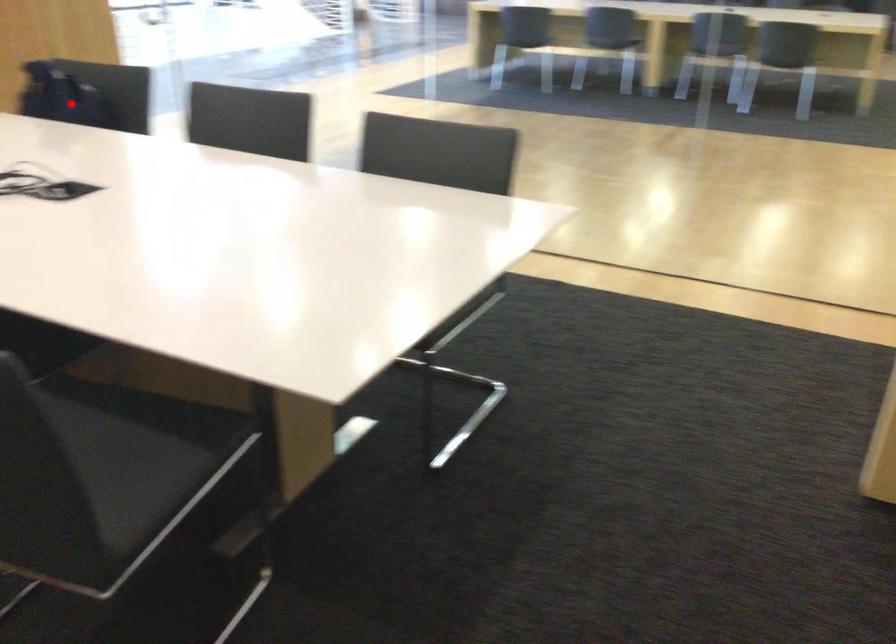
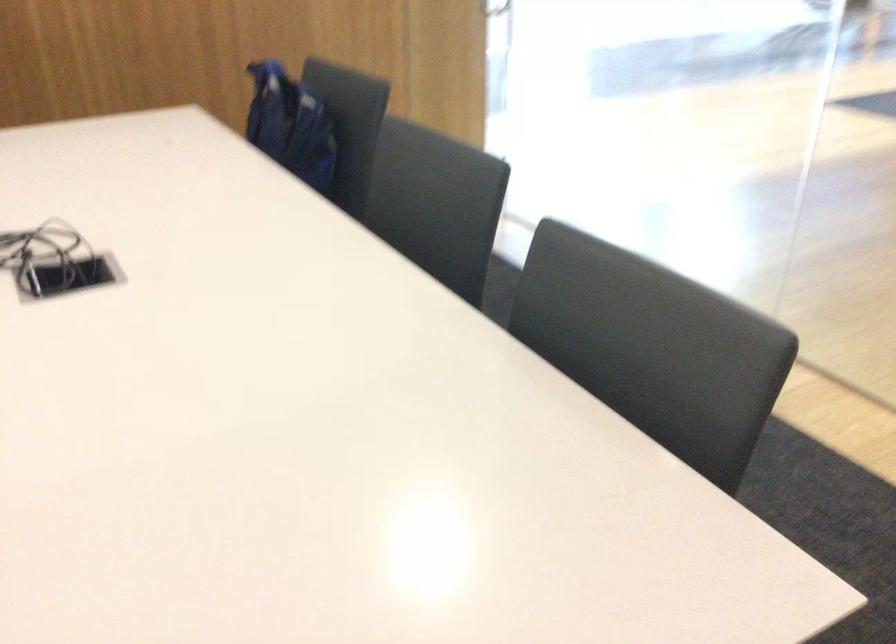
Question: A red point is marked in image1. In image2, is the corresponding 3D point closer to the camera or farther? Reply with the corresponding letter.

Choices:
 (A) The corresponding 3D point is closer.
 (B) The corresponding 3D point is farther.

Answer: (A)